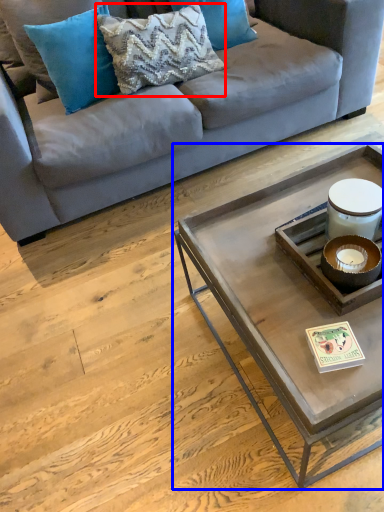
Question: Which point is closer to the camera, pillow (highlighted by a red box) or coffee table (highlighted by a blue box)?

Choices:
 (A) pillow
 (B) coffee table

Answer: (B)